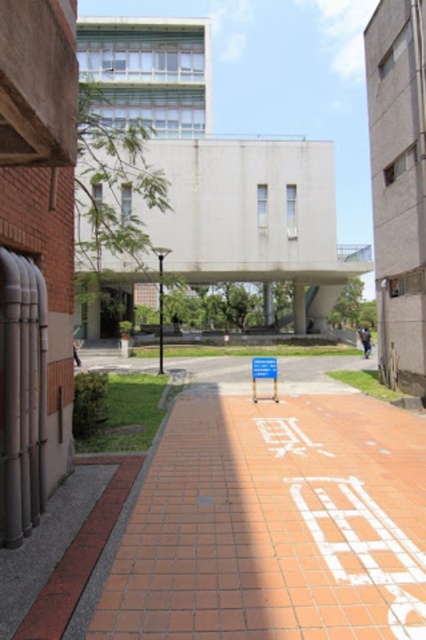
Question: Can you confirm if white painted brick at center is thinner than blue plastic sign at center?

Choices:
 (A) no
 (B) yes

Answer: (B)

Question: Which point is farther from the camera taking this photo?

Choices:
 (A) click(x=365, y=531)
 (B) click(x=253, y=400)

Answer: (B)

Question: Can you confirm if white painted brick at center is smaller than blue plastic sign at center?

Choices:
 (A) yes
 (B) no

Answer: (A)

Question: Is the position of white painted brick at center less distant than that of blue plastic sign at center?

Choices:
 (A) yes
 (B) no

Answer: (A)

Question: Which of the following is the farthest from the observer?

Choices:
 (A) pyautogui.click(x=331, y=512)
 (B) pyautogui.click(x=273, y=372)

Answer: (B)

Question: Which point appears farthest from the camera in this image?

Choices:
 (A) (342, 554)
 (B) (252, 380)

Answer: (B)